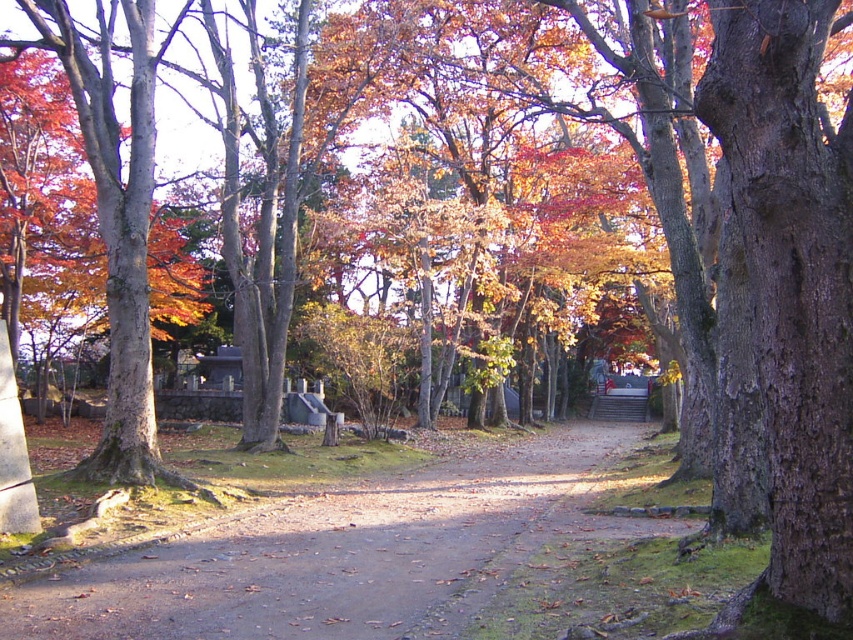
Can you confirm if dirt path at center is positioned to the right of smooth bark tree at left?

Yes, dirt path at center is to the right of smooth bark tree at left.

From the picture: Does dirt path at center appear under smooth bark tree at left?

Correct, dirt path at center is located below smooth bark tree at left.

Where is `dirt path at center`? The width and height of the screenshot is (853, 640). dirt path at center is located at coordinates (334, 556).